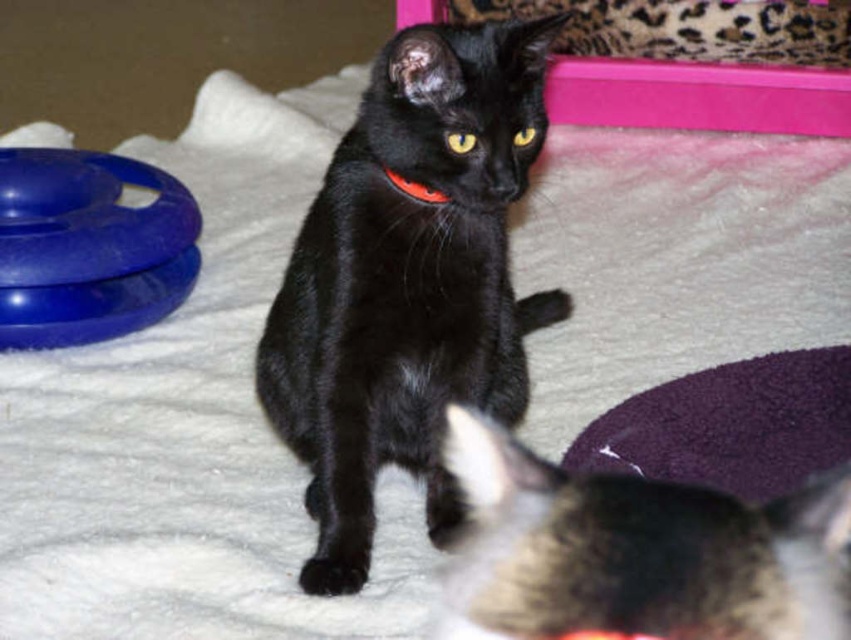
Question: Which of these objects is positioned closest to the black glossy fur cat at center?

Choices:
 (A) black fabric neckband at center
 (B) blue rubber ring at left

Answer: (A)

Question: Does black glossy fur cat at center appear over fluffy black cat at center?

Choices:
 (A) no
 (B) yes

Answer: (B)

Question: Considering the relative positions of black glossy fur cat at center and blue rubber ring at left in the image provided, where is black glossy fur cat at center located with respect to blue rubber ring at left?

Choices:
 (A) below
 (B) above

Answer: (A)

Question: Which of these objects is positioned closest to the black glossy fur cat at center?

Choices:
 (A) black fabric neckband at center
 (B) blue rubber ring at left
 (C) fluffy black cat at center

Answer: (A)

Question: Which object is farther from the camera taking this photo?

Choices:
 (A) black glossy fur cat at center
 (B) black fabric neckband at center
 (C) blue rubber ring at left
 (D) fluffy black cat at center

Answer: (C)

Question: Is blue rubber ring at left to the right of black fabric neckband at center from the viewer's perspective?

Choices:
 (A) yes
 (B) no

Answer: (B)